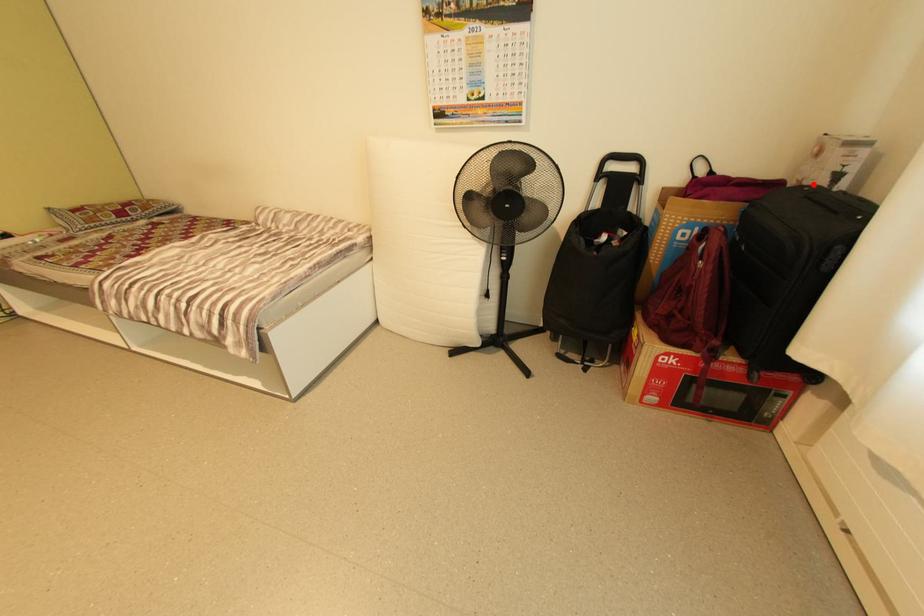
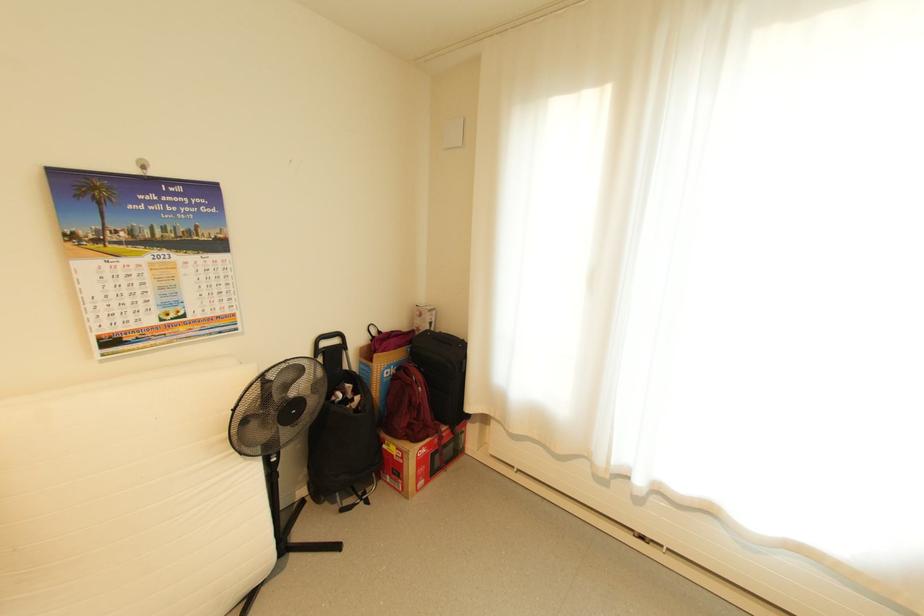
Find the pixel in the second image that matches the highlighted location in the first image.

(429, 330)